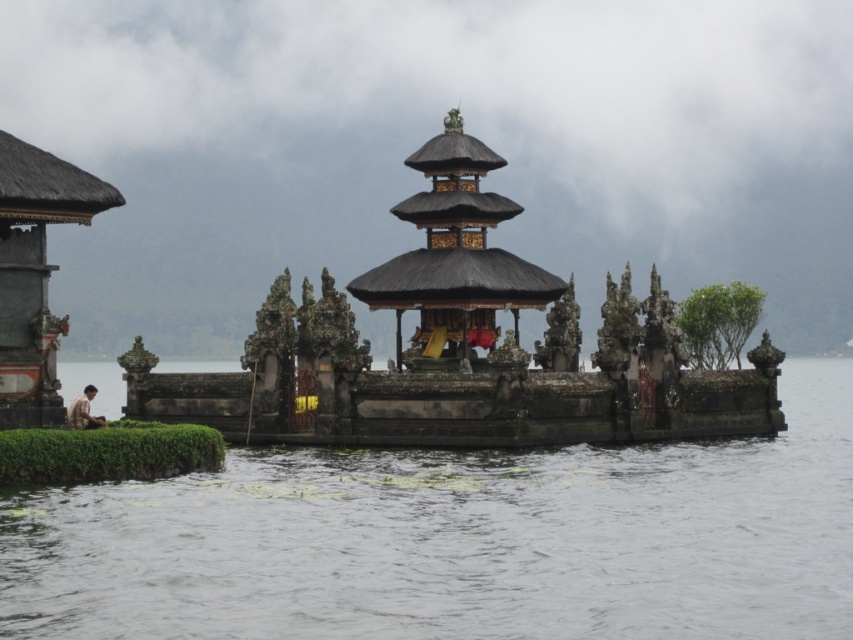
Does clear water at lower center have a greater width compared to matte black gazebo at left?

Yes.

Can you confirm if clear water at lower center is positioned to the left of matte black gazebo at left?

In fact, clear water at lower center is to the right of matte black gazebo at left.

Locate an element on the screen. This screenshot has height=640, width=853. clear water at lower center is located at coordinates (457, 540).

You are a GUI agent. You are given a task and a screenshot of the screen. Output one action in this format:
    pyautogui.click(x=<x>, y=<y>)
    Task: Click on the clear water at lower center
    
    Given the screenshot: What is the action you would take?
    pyautogui.click(x=457, y=540)

Which is below, dark brown wooden temple at center or matte black gazebo at left?

Positioned lower is dark brown wooden temple at center.

Which is in front, point (641, 364) or point (10, 372)?

Point (10, 372) is in front.

You are a GUI agent. You are given a task and a screenshot of the screen. Output one action in this format:
    pyautogui.click(x=<x>, y=<y>)
    Task: Click on the dark brown wooden temple at center
    
    Given the screenshot: What is the action you would take?
    pyautogui.click(x=461, y=348)

Between dark brown wooden temple at center and dark brown wooden gazebo at center, which one has more height?

dark brown wooden temple at center is taller.

Does dark brown wooden temple at center appear under dark brown wooden gazebo at center?

Correct, dark brown wooden temple at center is located below dark brown wooden gazebo at center.

I want to click on dark brown wooden temple at center, so click(x=461, y=348).